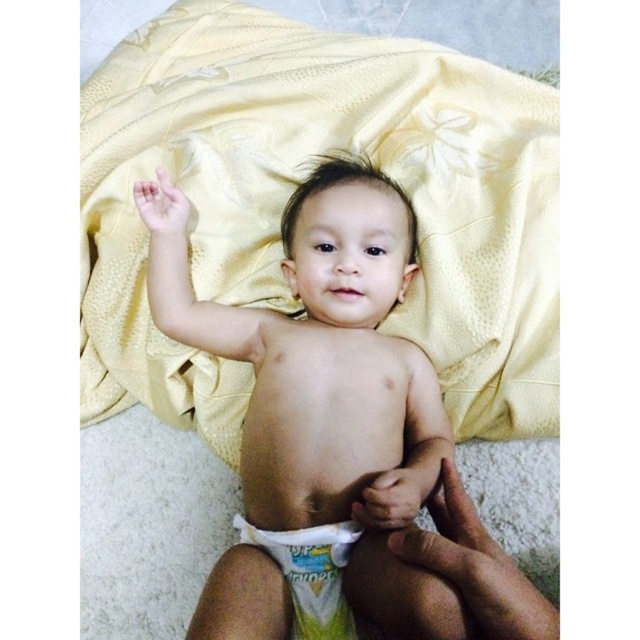
Which is in front, point (504, 333) or point (168, 195)?

Point (504, 333) is more forward.

Does yellow satin blanket at upper center have a greater height compared to smooth skin baby at center?

Indeed, yellow satin blanket at upper center has a greater height compared to smooth skin baby at center.

Between point (470, 406) and point (140, 204), which one is positioned in front?

Point (470, 406)

Find the location of `yellow satin blanket at upper center`. yellow satin blanket at upper center is located at coordinates (294, 188).

Is skinny white diaper at lower center wider than white cloth diaper at center?

Yes, skinny white diaper at lower center is wider than white cloth diaper at center.

Is skinny white diaper at lower center to the right of white cloth diaper at center from the viewer's perspective?

Yes, skinny white diaper at lower center is to the right of white cloth diaper at center.

Does point (548, 604) come in front of point (342, 605)?

Yes, it is.

Locate an element on the screen. skinny white diaper at lower center is located at coordinates (476, 566).

Can you confirm if smooth skin baby at center is positioned to the left of skinny white diaper at lower center?

Yes, smooth skin baby at center is to the left of skinny white diaper at lower center.

Does smooth skin baby at center come behind skinny white diaper at lower center?

Yes, it is behind skinny white diaper at lower center.

At what (x,y) coordinates should I click in order to perform the action: click on smooth skin baby at center. Please return your answer as a coordinate pair (x, y). The image size is (640, 640). Looking at the image, I should click on (326, 380).

This screenshot has height=640, width=640. What are the coordinates of `smooth skin baby at center` in the screenshot? It's located at (326, 380).